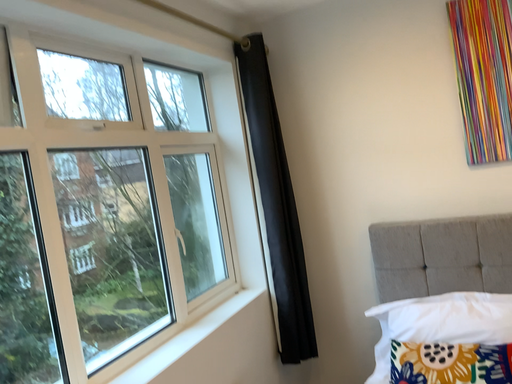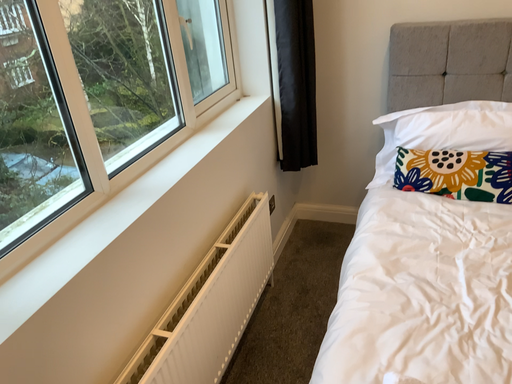
Question: Which way did the camera rotate in the video?

Choices:
 (A) rotated upward
 (B) rotated downward

Answer: (B)